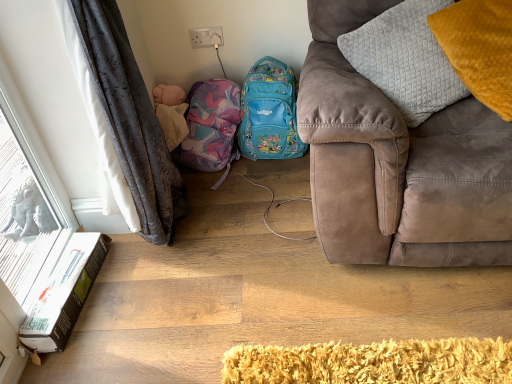
Question: Is white cardboard box at lower left thinner than quilted gray pillow at upper right, the first pillow positioned from the left?

Choices:
 (A) no
 (B) yes

Answer: (A)

Question: From a real-world perspective, is white cardboard box at lower left physically above quilted gray pillow at upper right, the second pillow positioned from the right?

Choices:
 (A) no
 (B) yes

Answer: (A)

Question: Is white cardboard box at lower left shorter than quilted gray pillow at upper right, the second pillow positioned from the right?

Choices:
 (A) yes
 (B) no

Answer: (A)

Question: Can you confirm if white cardboard box at lower left is wider than quilted gray pillow at upper right, the first pillow positioned from the left?

Choices:
 (A) yes
 (B) no

Answer: (A)

Question: From the image's perspective, is white cardboard box at lower left under quilted gray pillow at upper right, the second pillow positioned from the right?

Choices:
 (A) no
 (B) yes

Answer: (B)

Question: Considering the positions of matte purple backpack at center and quilted gray pillow at upper right, the second pillow positioned from the right, in the image, is matte purple backpack at center wider or thinner than quilted gray pillow at upper right, the second pillow positioned from the right,?

Choices:
 (A) thin
 (B) wide

Answer: (B)

Question: Would you say matte purple backpack at center is to the left or to the right of quilted gray pillow at upper right, the first pillow positioned from the left, in the picture?

Choices:
 (A) right
 (B) left

Answer: (B)

Question: Considering the positions of matte purple backpack at center and quilted gray pillow at upper right, the first pillow positioned from the left, in the image, is matte purple backpack at center bigger or smaller than quilted gray pillow at upper right, the first pillow positioned from the left,?

Choices:
 (A) big
 (B) small

Answer: (B)

Question: From their relative heights in the image, would you say matte purple backpack at center is taller or shorter than quilted gray pillow at upper right, the first pillow positioned from the left?

Choices:
 (A) short
 (B) tall

Answer: (A)

Question: From a real-world perspective, is white frosted glass at left physically located above or below white cardboard box at lower left?

Choices:
 (A) above
 (B) below

Answer: (A)

Question: From the image's perspective, is white frosted glass at left above or below white cardboard box at lower left?

Choices:
 (A) below
 (B) above

Answer: (B)

Question: In the image, is white frosted glass at left on the left side or the right side of white cardboard box at lower left?

Choices:
 (A) left
 (B) right

Answer: (A)

Question: Would you say white frosted glass at left is inside or outside white cardboard box at lower left?

Choices:
 (A) outside
 (B) inside

Answer: (A)

Question: Is point (493, 66) closer or farther from the camera than point (231, 119)?

Choices:
 (A) farther
 (B) closer

Answer: (B)

Question: Is yellow velvet pillow at upper right, which is the first pillow in right-to-left order, to the left or to the right of matte purple backpack at center in the image?

Choices:
 (A) left
 (B) right

Answer: (B)